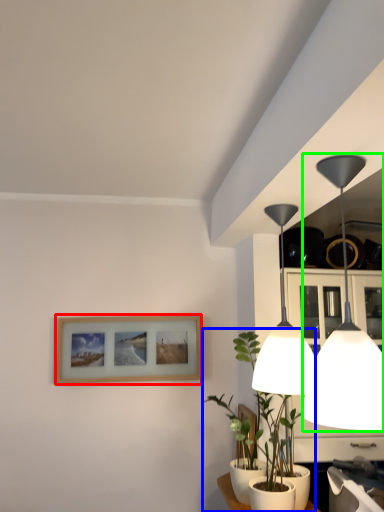
Question: Estimate the real-world distances between objects in this image. Which object is closer to picture frame (highlighted by a red box), houseplant (highlighted by a blue box) or lamp (highlighted by a green box)?

Choices:
 (A) houseplant
 (B) lamp

Answer: (A)